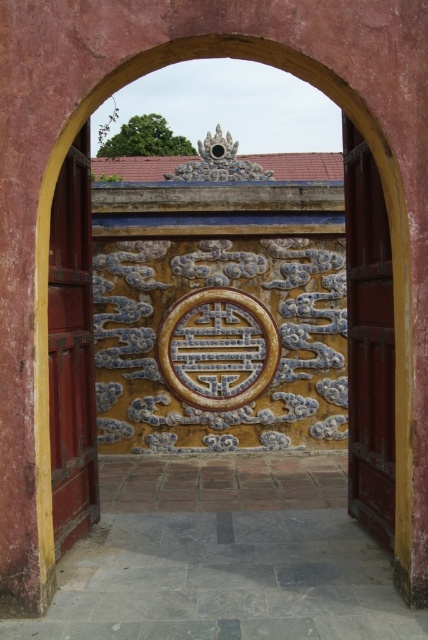
Which is more to the left, smooth red wood door at right or smooth red wood door at left?

smooth red wood door at left is more to the left.

The height and width of the screenshot is (640, 428). I want to click on smooth red wood door at right, so click(368, 340).